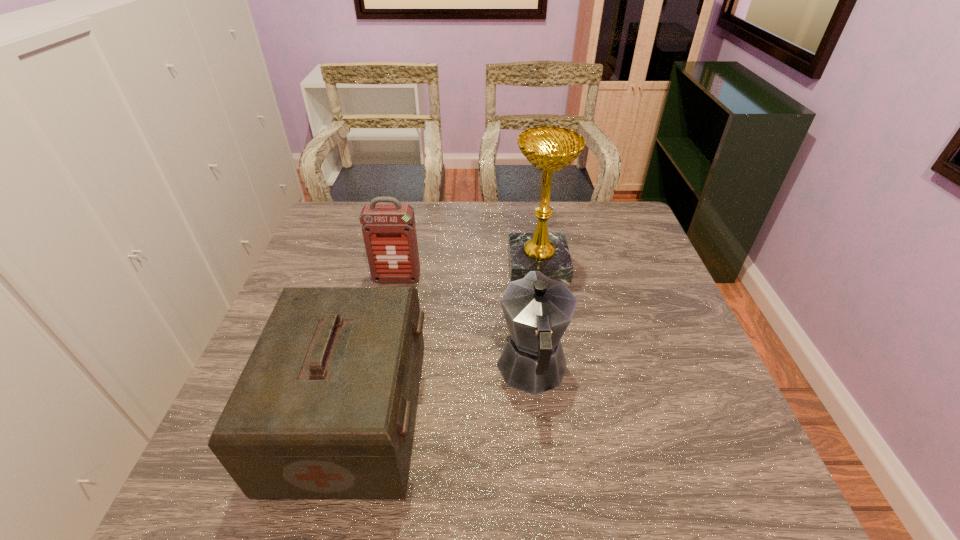
The width and height of the screenshot is (960, 540). Find the location of `award`. award is located at coordinates (549, 149).

The height and width of the screenshot is (540, 960). I want to click on the farther first-aid kit, so click(x=389, y=231).

Image resolution: width=960 pixels, height=540 pixels. I want to click on coffeepot, so click(x=538, y=310).

Where is `the nearer first-aid kit`? Image resolution: width=960 pixels, height=540 pixels. the nearer first-aid kit is located at coordinates (325, 407).

At what (x,y) coordinates should I click in order to perform the action: click on vacant space located 0.290m on the front-facing side of the tallest object. Please return your answer as a coordinate pair (x, y). This screenshot has height=540, width=960. Looking at the image, I should click on (411, 265).

Find the location of `vacant space located 0.130m on the front-facing side of the tallest object`. vacant space located 0.130m on the front-facing side of the tallest object is located at coordinates (465, 265).

Locate an element on the screen. The height and width of the screenshot is (540, 960). vacant space located 0.060m on the front-facing side of the tallest object is located at coordinates (489, 265).

Find the location of `vacant area situated on the front-facing side of the farther first-aid kit`. vacant area situated on the front-facing side of the farther first-aid kit is located at coordinates (381, 355).

You are a GUI agent. You are given a task and a screenshot of the screen. Output one action in this format:
    pyautogui.click(x=<x>, y=<y>)
    Task: Click on the blank area located at the spout of the coffeepot
    
    Given the screenshot: What is the action you would take?
    pyautogui.click(x=518, y=245)

At what (x,y) coordinates should I click in order to perform the action: click on vacant space situated at the spout of the coffeepot. Please return your answer as a coordinate pair (x, y). This screenshot has height=540, width=960. Looking at the image, I should click on (518, 245).